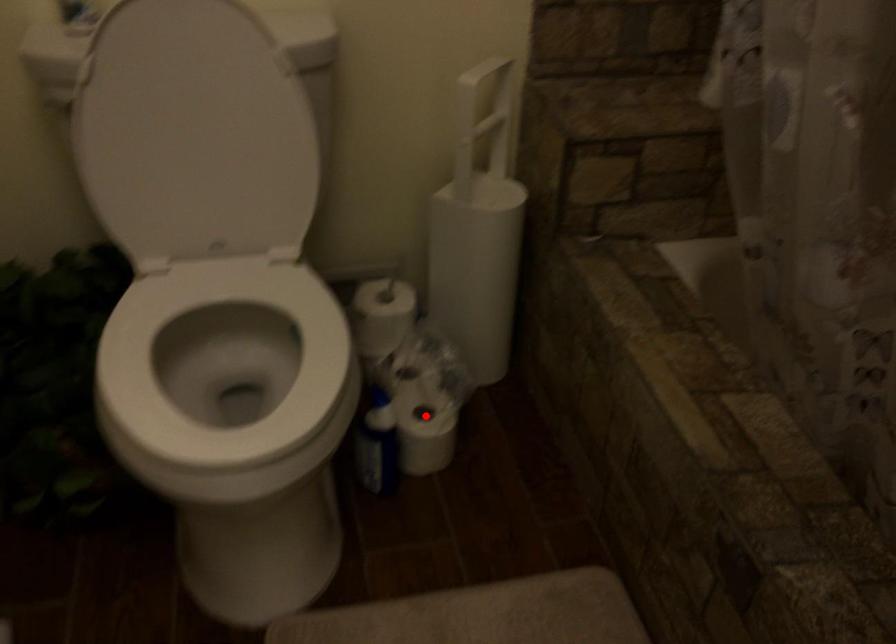
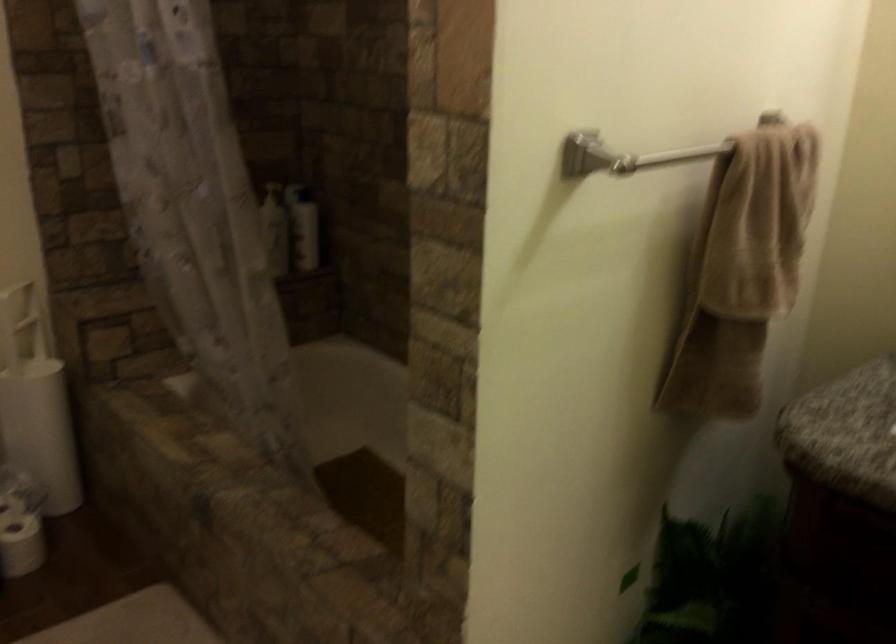
Question: I am providing you with two images of the same scene from different viewpoints. In image1, a red point is highlighted. Considering the same 3D point in image2, which of the following is correct?

Choices:
 (A) It is closer
 (B) It is farther

Answer: (B)